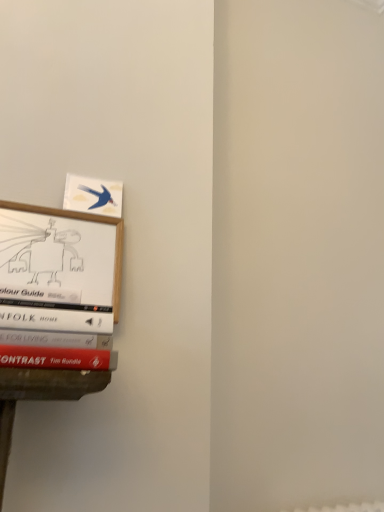
Question: Is matte blue bird at upper left taller or shorter than wooden picture frame at left?

Choices:
 (A) tall
 (B) short

Answer: (B)

Question: Which is correct: matte blue bird at upper left is inside wooden picture frame at left, or outside of it?

Choices:
 (A) outside
 (B) inside

Answer: (A)

Question: Does point (115, 194) appear closer or farther from the camera than point (52, 214)?

Choices:
 (A) farther
 (B) closer

Answer: (A)

Question: Does point (119, 280) appear closer or farther from the camera than point (92, 183)?

Choices:
 (A) closer
 (B) farther

Answer: (A)

Question: Is wooden picture frame at left in front of or behind matte blue bird at upper left in the image?

Choices:
 (A) front
 (B) behind

Answer: (A)

Question: Would you say wooden picture frame at left is inside or outside matte blue bird at upper left?

Choices:
 (A) inside
 (B) outside

Answer: (B)

Question: From the image's perspective, is wooden picture frame at left located above or below matte blue bird at upper left?

Choices:
 (A) below
 (B) above

Answer: (A)